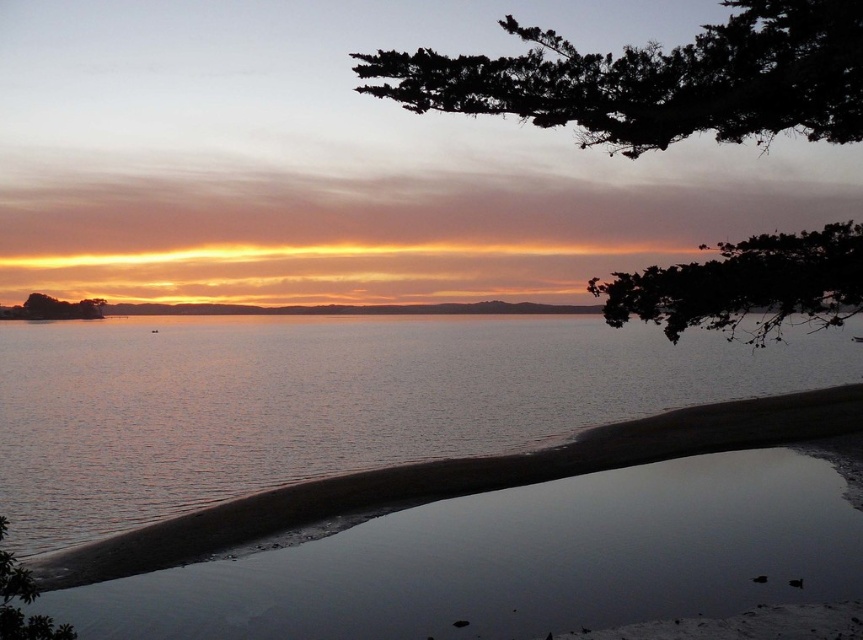
Question: Is dark green leafy tree at upper center bigger than green leafy tree at lower left?

Choices:
 (A) no
 (B) yes

Answer: (B)

Question: Can you confirm if dark green textured branch at upper right is wider than dark green leafy branch at upper right?

Choices:
 (A) no
 (B) yes

Answer: (B)

Question: Which point is closer to the camera?

Choices:
 (A) dark green textured rock at upper left
 (B) dark green leafy tree at upper center

Answer: (B)

Question: Which point is closer to the camera taking this photo?

Choices:
 (A) (98, 305)
 (B) (754, 282)
 (C) (10, 554)

Answer: (B)

Question: Where is green leafy tree at lower left located in relation to dark green textured rock at upper left in the image?

Choices:
 (A) right
 (B) left

Answer: (A)

Question: Among these points, which one is nearest to the camera?

Choices:
 (A) (93, 314)
 (B) (819, 285)
 (C) (16, 596)

Answer: (C)